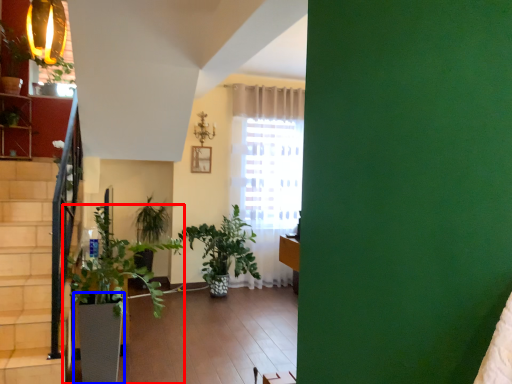
Question: Among these objects, which one is nearest to the camera, houseplant (highlighted by a red box) or flowerpot (highlighted by a blue box)?

Choices:
 (A) houseplant
 (B) flowerpot

Answer: (A)